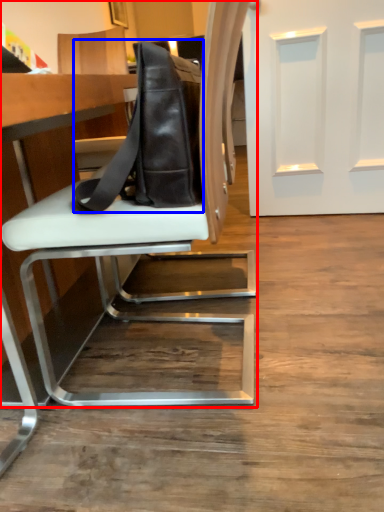
Question: Which object appears farthest to the camera in this image, chair (highlighted by a red box) or messenger bag (highlighted by a blue box)?

Choices:
 (A) chair
 (B) messenger bag

Answer: (B)